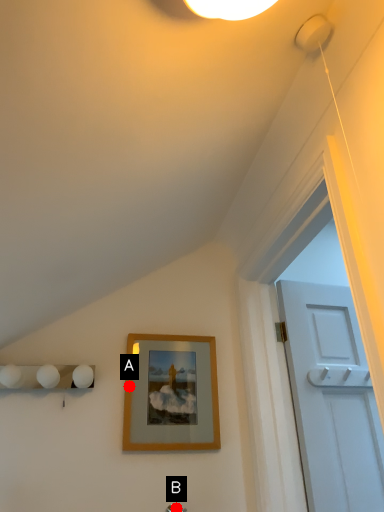
Question: Two points are circled on the image, labeled by A and B beside each circle. Which point is further to the camera?

Choices:
 (A) A is further
 (B) B is further

Answer: (A)